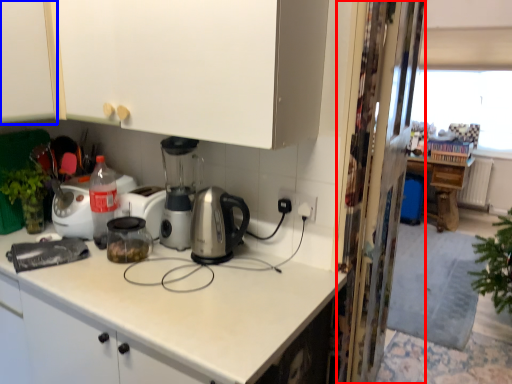
Question: Among these objects, which one is nearest to the camera, screen door (highlighted by a red box) or cabinetry (highlighted by a blue box)?

Choices:
 (A) screen door
 (B) cabinetry

Answer: (B)